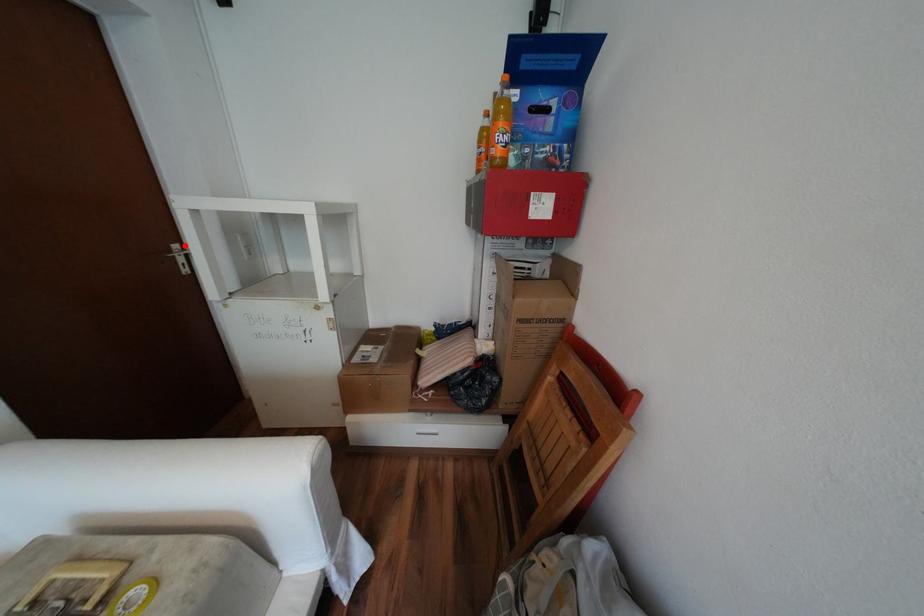
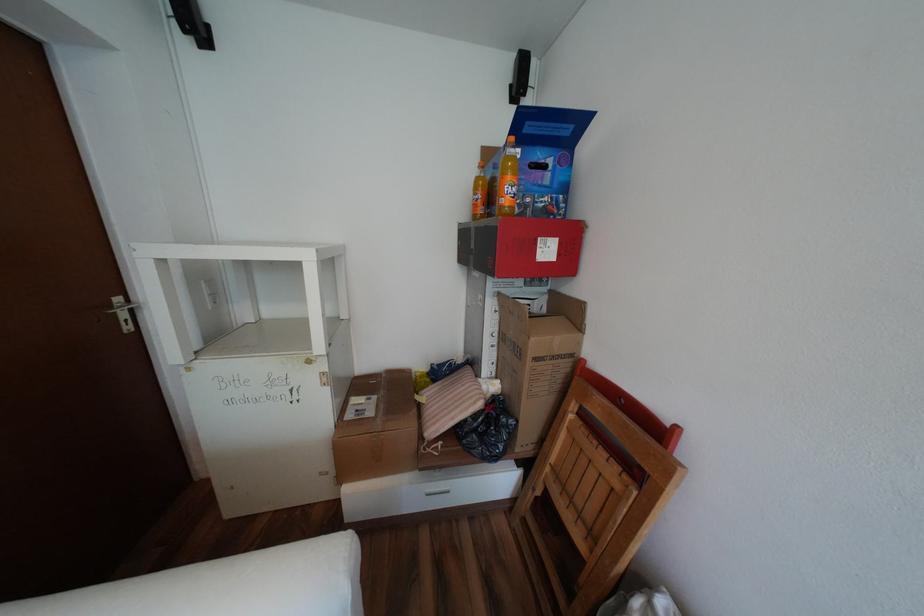
Find the pixel in the second image that matches the highlighted location in the first image.

(128, 299)